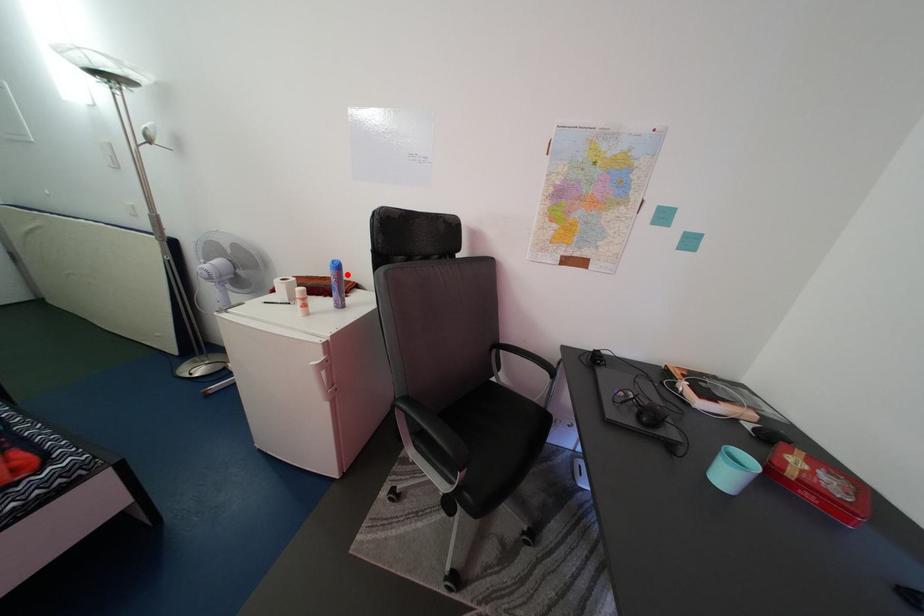
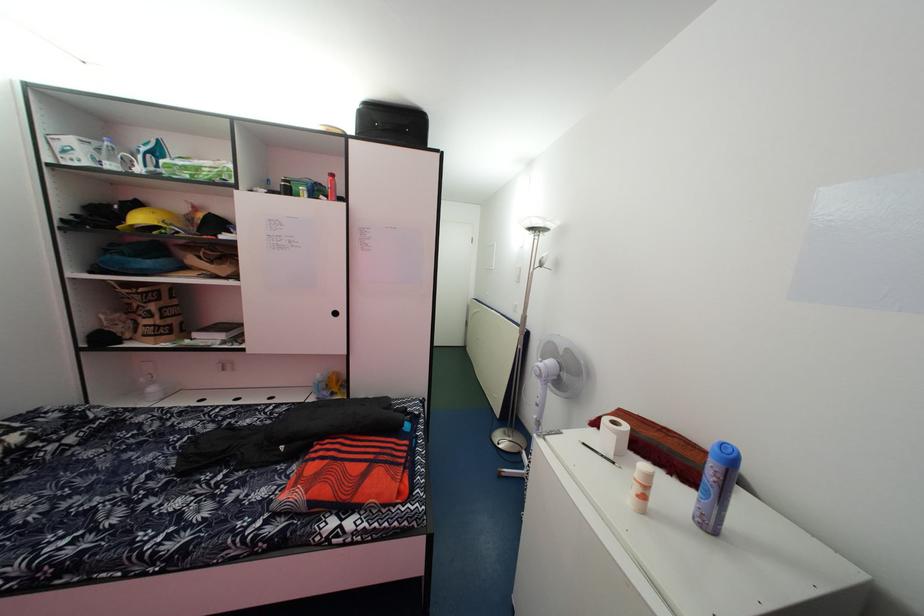
Question: I am providing you with two images of the same scene from different viewpoints. A red point is marked on the first image. Is the red point's position out of view in image 2?

Choices:
 (A) Yes
 (B) No

Answer: (B)